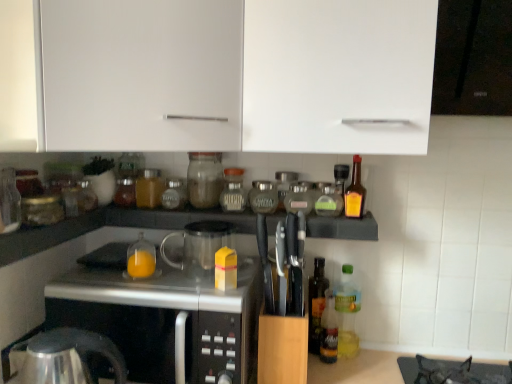
Where is `vacant area on the back side of translucent glass bottle at center, the 1th orange juice positioned from the back`? This screenshot has width=512, height=384. vacant area on the back side of translucent glass bottle at center, the 1th orange juice positioned from the back is located at coordinates (172, 264).